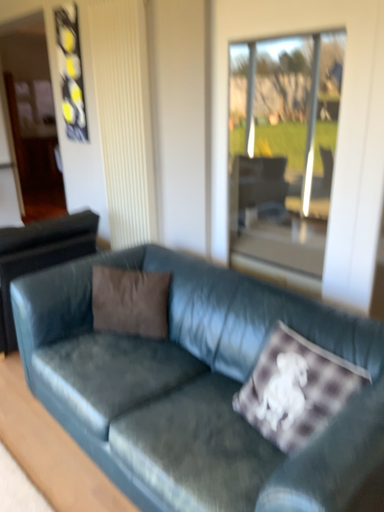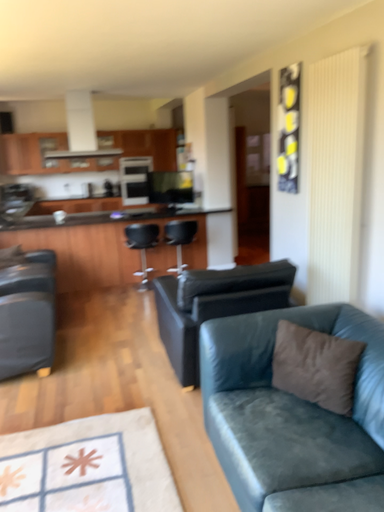
Question: Which way did the camera rotate in the video?

Choices:
 (A) rotated left
 (B) rotated right

Answer: (A)